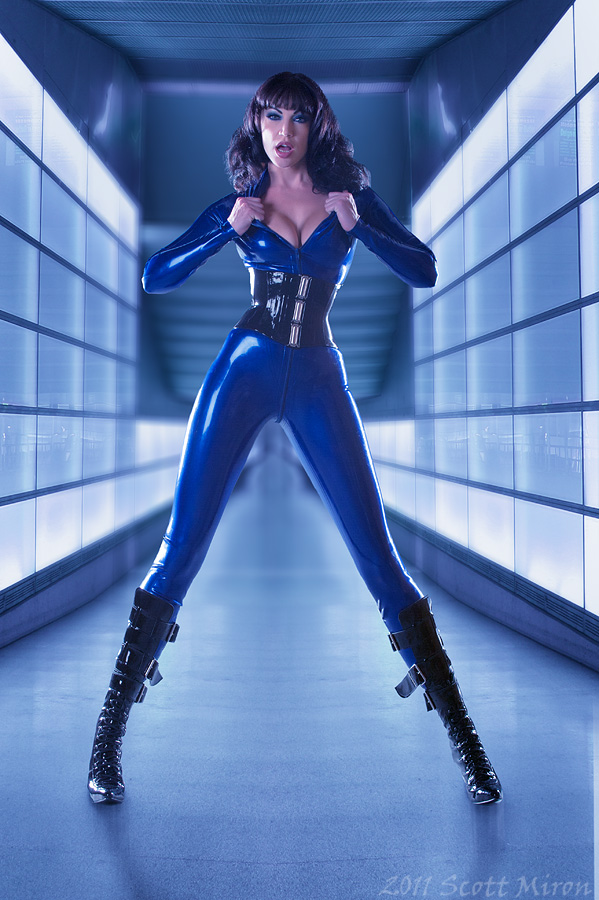
Identify the location of walls. This screenshot has width=599, height=900. (530, 394), (58, 372).